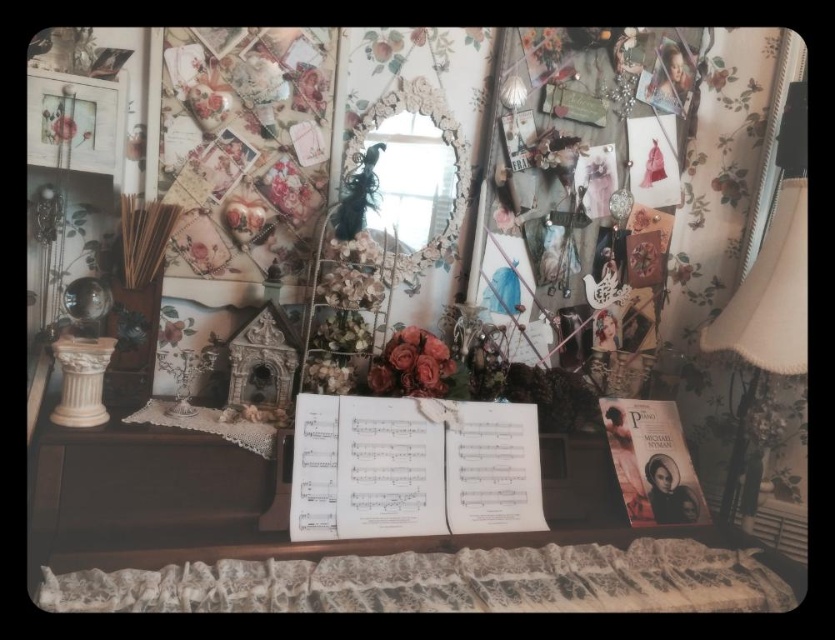
Question: Does beige fabric lampshade at right have a larger size compared to shiny silver mirror at center?

Choices:
 (A) yes
 (B) no

Answer: (A)

Question: Can you confirm if beige fabric lampshade at right is positioned to the left of matte white picture frame at upper left?

Choices:
 (A) yes
 (B) no

Answer: (B)

Question: Which object is the farthest from the shiny silver mirror at center?

Choices:
 (A) matte pink roses at center
 (B) matte pink flower at upper left
 (C) matte white picture frame at upper left

Answer: (B)

Question: Which is nearer to the wooden table at center?

Choices:
 (A) beige fabric lampshade at right
 (B) matte pink flower at upper left

Answer: (A)

Question: Which of the following is the closest to the observer?

Choices:
 (A) (62, 115)
 (B) (292, 589)
 (C) (408, 90)

Answer: (B)

Question: Is wooden table at center positioned at the back of beige fabric lampshade at right?

Choices:
 (A) yes
 (B) no

Answer: (B)